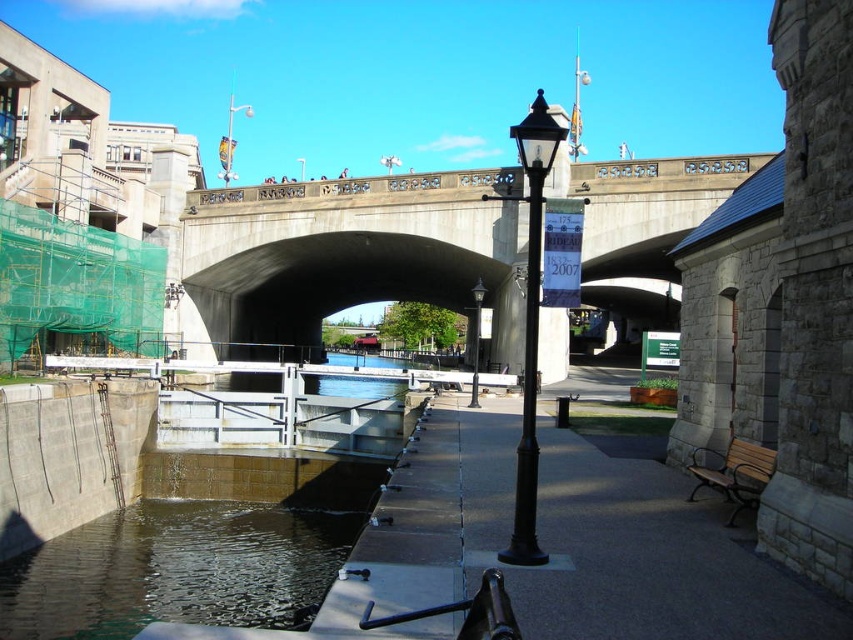
Can you confirm if smooth concrete pavement at center is wider than black metal lamp post at center?

Indeed, smooth concrete pavement at center has a greater width compared to black metal lamp post at center.

Can you confirm if smooth concrete pavement at center is positioned to the left of black metal lamp post at center?

Correct, you'll find smooth concrete pavement at center to the left of black metal lamp post at center.

I want to click on smooth concrete pavement at center, so click(x=648, y=561).

Does point (537, 260) come farther from viewer compared to point (474, 337)?

No.

Does black metal streetlight at center come behind black metal lamp post at center?

No.

Where is `black metal streetlight at center`? The width and height of the screenshot is (853, 640). black metal streetlight at center is located at coordinates (531, 323).

Locate an element on the screen. This screenshot has height=640, width=853. black metal streetlight at center is located at coordinates (531, 323).

Between smooth concrete pavement at center and black metal pole at center, which one appears on the right side from the viewer's perspective?

Positioned to the right is black metal pole at center.

Describe the element at coordinates (648, 561) in the screenshot. I see `smooth concrete pavement at center` at that location.

At what (x,y) coordinates should I click in order to perform the action: click on smooth concrete pavement at center. Please return your answer as a coordinate pair (x, y). Image resolution: width=853 pixels, height=640 pixels. Looking at the image, I should click on (648, 561).